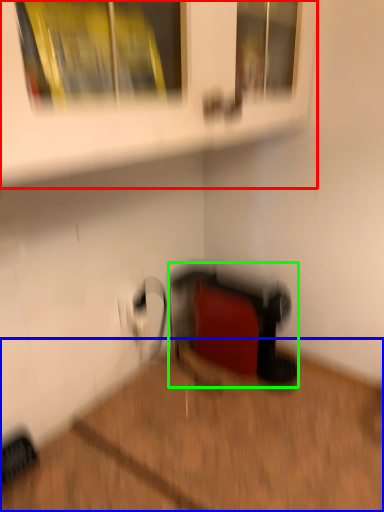
Question: Considering the real-world distances, which object is closest to shelf (highlighted by a red box)? hardwood (highlighted by a blue box) or wide (highlighted by a green box).

Choices:
 (A) hardwood
 (B) wide

Answer: (B)